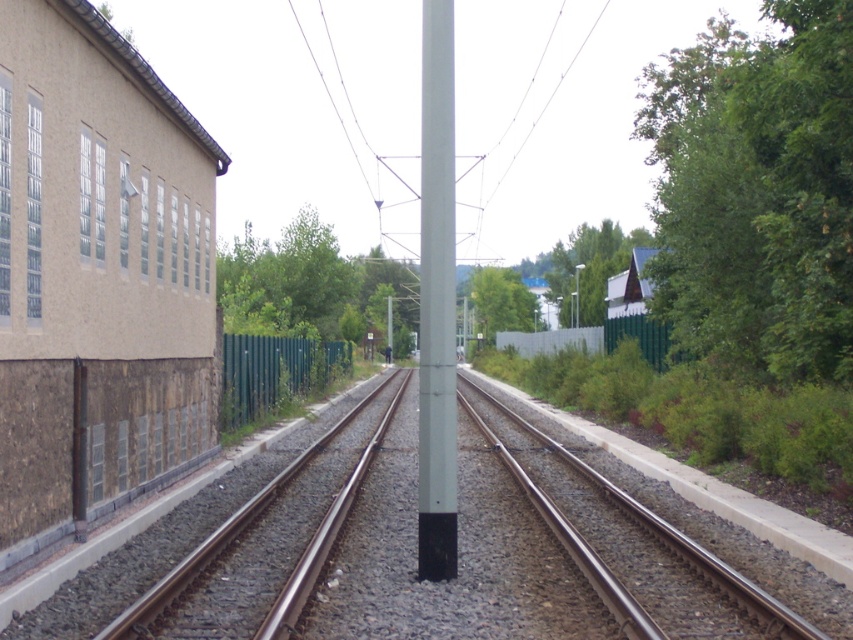
You are a landscape architect designing a new park layout. You need to place two green leafy trees in the park. The first tree is labeled as green leafy tree at upper center and the second as green leafy tree at center. Based on the image provided, which tree should be placed closer to the entrance to ensure visitors can see the taller tree from the entrance?

The green leafy tree at upper center is taller than the green leafy tree at center. To ensure visitors can see the taller tree from the entrance, place the green leafy tree at upper center closer to the entrance so it is visible upon arrival.

You are a railway worker checking the tracks. You see the brown gravel train track at center and the green leafy tree at right. Which object is closer to the ground?

The brown gravel train track at center is located below the green leafy tree at right, so the brown gravel train track at center is closer to the ground.